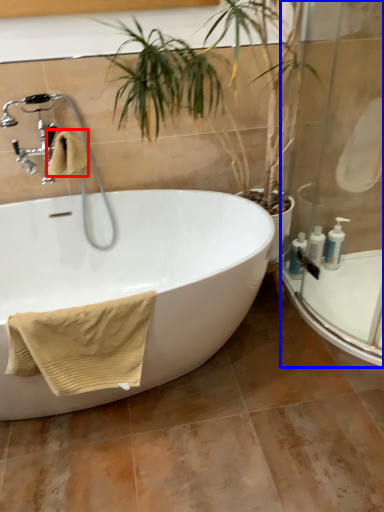
Question: Which object is further to the camera taking this photo, bath towel (highlighted by a red box) or shower door (highlighted by a blue box)?

Choices:
 (A) bath towel
 (B) shower door

Answer: (A)